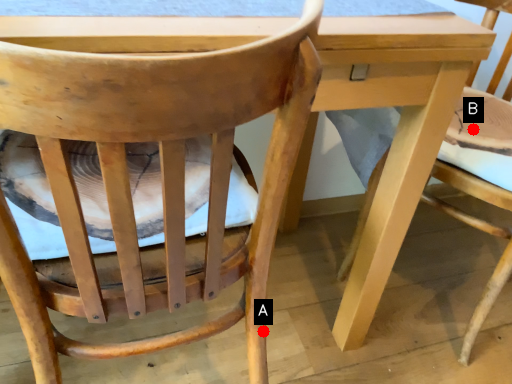
Question: Two points are circled on the image, labeled by A and B beside each circle. Which of the following is the closest to the observer?

Choices:
 (A) A is closer
 (B) B is closer

Answer: (A)